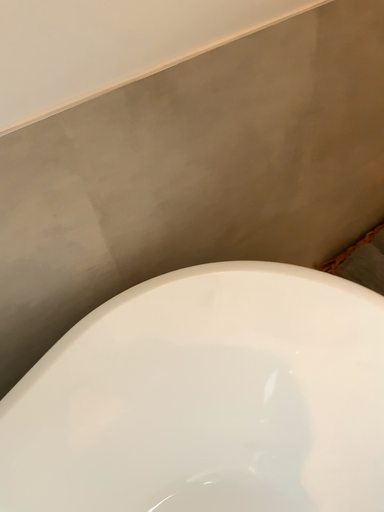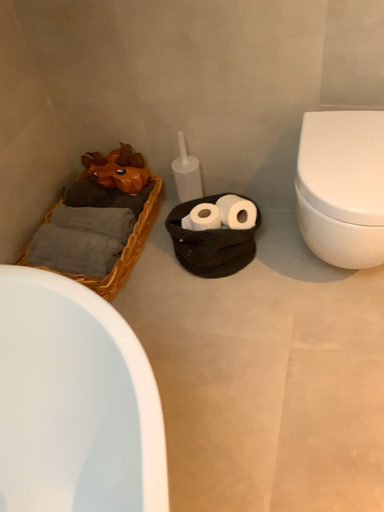
Question: Which way did the camera rotate in the video?

Choices:
 (A) rotated left
 (B) rotated right

Answer: (B)